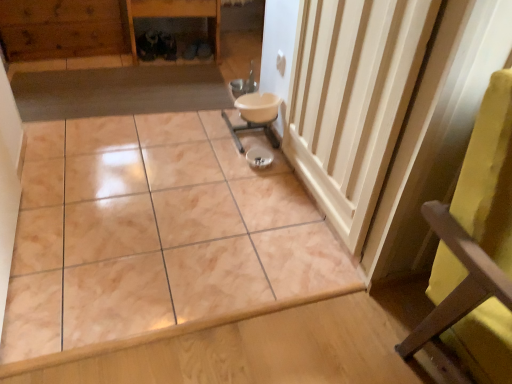
Question: Is wooden cabinet at upper left smaller than white wood radiator at center right?

Choices:
 (A) no
 (B) yes

Answer: (A)

Question: Is wooden cabinet at upper left positioned with its back to white wood radiator at center right?

Choices:
 (A) yes
 (B) no

Answer: (B)

Question: Can you confirm if wooden cabinet at upper left is wider than white wood radiator at center right?

Choices:
 (A) yes
 (B) no

Answer: (A)

Question: Are wooden cabinet at upper left and white wood radiator at center right making contact?

Choices:
 (A) yes
 (B) no

Answer: (B)

Question: Could white wood radiator at center right be considered to be inside wooden cabinet at upper left?

Choices:
 (A) no
 (B) yes

Answer: (A)

Question: Looking at their shapes, would you say white glossy sink at center is wider or thinner than marble tile at center?

Choices:
 (A) thin
 (B) wide

Answer: (A)

Question: Considering the relative positions of white glossy sink at center and marble tile at center in the image provided, is white glossy sink at center to the left or to the right of marble tile at center?

Choices:
 (A) left
 (B) right

Answer: (B)

Question: From a real-world perspective, is white glossy sink at center above or below marble tile at center?

Choices:
 (A) above
 (B) below

Answer: (A)

Question: From their relative heights in the image, would you say white glossy sink at center is taller or shorter than marble tile at center?

Choices:
 (A) tall
 (B) short

Answer: (A)

Question: Is point (50, 26) positioned closer to the camera than point (378, 183)?

Choices:
 (A) closer
 (B) farther

Answer: (B)

Question: From the image's perspective, is wooden cabinet at upper left above or below white wood radiator at center right?

Choices:
 (A) below
 (B) above

Answer: (B)

Question: Is wooden cabinet at upper left in front of or behind white wood radiator at center right in the image?

Choices:
 (A) front
 (B) behind

Answer: (B)

Question: From their relative heights in the image, would you say wooden cabinet at upper left is taller or shorter than white wood radiator at center right?

Choices:
 (A) short
 (B) tall

Answer: (A)

Question: Would you say marble tile at center is to the left or to the right of wooden cabinet at upper left in the picture?

Choices:
 (A) right
 (B) left

Answer: (A)

Question: Considering the positions of marble tile at center and wooden cabinet at upper left in the image, is marble tile at center taller or shorter than wooden cabinet at upper left?

Choices:
 (A) tall
 (B) short

Answer: (B)